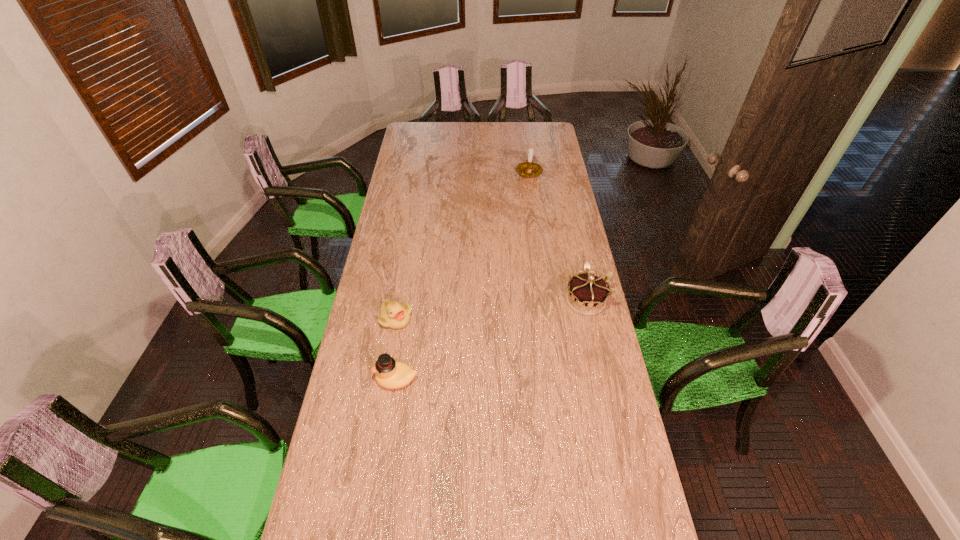
Identify the location of free space located 0.050m with a handle on the tallest object. This screenshot has width=960, height=540. (529, 187).

I want to click on vacant space situated 0.060m with a handle on the tallest object, so click(x=529, y=188).

You are a GUI agent. You are given a task and a screenshot of the screen. Output one action in this format:
    pyautogui.click(x=<x>, y=<y>)
    Task: Click on the vacant area located with a handle on the tallest object
    Image resolution: width=960 pixels, height=540 pixels.
    Given the screenshot: What is the action you would take?
    pyautogui.click(x=529, y=192)

Identify the location of duck located at the left edge. (389, 373).

At what (x,y) coordinates should I click in order to perform the action: click on duckling at the left edge. Please return your answer as a coordinate pair (x, y). The width and height of the screenshot is (960, 540). Looking at the image, I should click on (394, 315).

I want to click on crown positioned at the right edge, so click(x=587, y=294).

Where is `candle holder present at the right edge`? This screenshot has width=960, height=540. candle holder present at the right edge is located at coordinates click(x=526, y=169).

Locate an element on the screen. The image size is (960, 540). vacant space at the near edge of the desktop is located at coordinates (584, 485).

At what (x,y) coordinates should I click in order to perform the action: click on vacant space at the left edge of the desktop. Please return your answer as a coordinate pair (x, y). This screenshot has height=540, width=960. Looking at the image, I should click on (405, 183).

The image size is (960, 540). Find the location of `free location at the right edge`. free location at the right edge is located at coordinates pos(543,191).